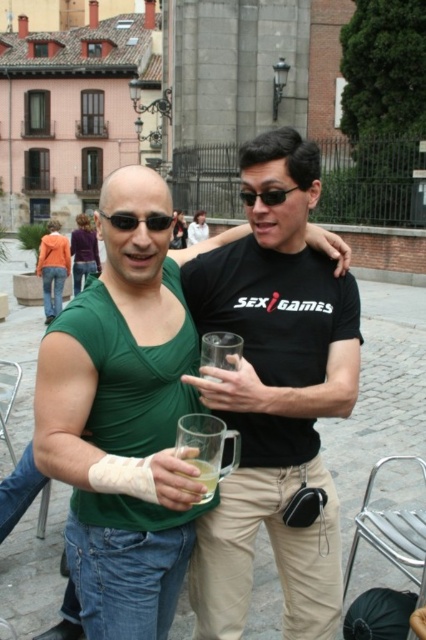
Question: Is translucent glass mug at center bigger than white fabric shirt at upper center?

Choices:
 (A) no
 (B) yes

Answer: (A)

Question: Among these objects, which one is nearest to the camera?

Choices:
 (A) purple sweater at center
 (B) translucent glass mug at center

Answer: (B)

Question: Which of the following is the farthest from the observer?

Choices:
 (A) (206, 228)
 (B) (193, 458)
 (C) (313, 172)

Answer: (A)

Question: Is purple sweater at center positioned behind matte black sunglasses at upper center?

Choices:
 (A) yes
 (B) no

Answer: (A)

Question: Which point is closer to the camera taking this photo?

Choices:
 (A) (129, 227)
 (B) (42, 284)
 (C) (183, 228)

Answer: (A)

Question: Is orange cotton jacket at upper left positioned before matte black sunglasses at upper center?

Choices:
 (A) yes
 (B) no

Answer: (B)